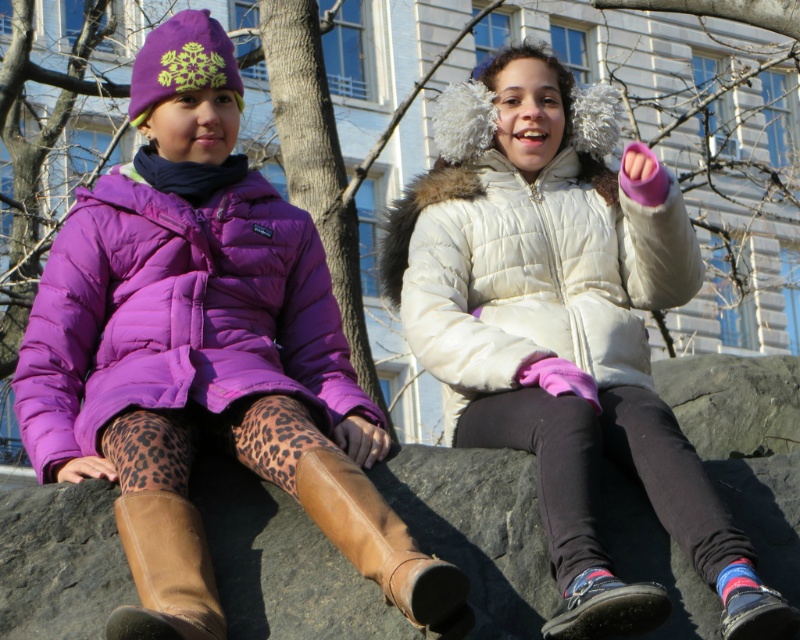
Question: Based on their relative distances, which object is farther from the bare branches at center?

Choices:
 (A) white fluffy earmuffs at upper center
 (B) brown leather boot at lower center
 (C) purple matte jacket at upper left

Answer: (B)

Question: Among these points, which one is nearest to the camera?

Choices:
 (A) (428, 29)
 (B) (550, 378)
 (C) (554, 292)

Answer: (B)

Question: In this image, where is white quilted jacket at center located relative to brown leather boot at lower center?

Choices:
 (A) below
 (B) above

Answer: (B)

Question: Which of the following is the farthest from the observer?

Choices:
 (A) brown leather boot at lower center
 (B) brown leather boots at lower center

Answer: (B)

Question: Does purple matte jacket at upper left appear under purple down jacket at left?

Choices:
 (A) no
 (B) yes

Answer: (B)

Question: Considering the relative positions of purple matte jacket at upper left and brown leather boots at lower center in the image provided, where is purple matte jacket at upper left located with respect to brown leather boots at lower center?

Choices:
 (A) above
 (B) below

Answer: (A)